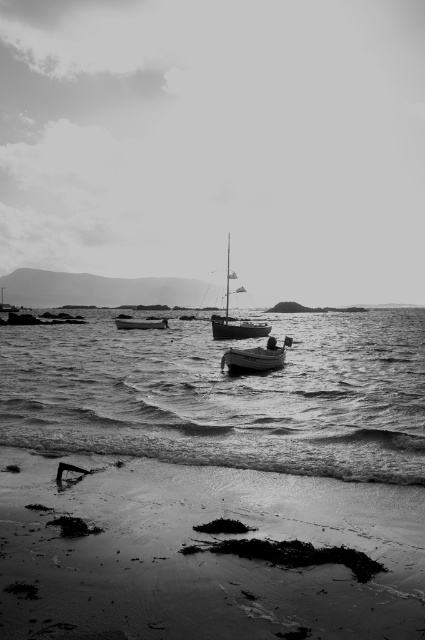
Question: Estimate the real-world distances between objects in this image. Which object is farther from the wooden sailboat at center?

Choices:
 (A) smooth wooden boat at center
 (B) smooth water at center
 (C) smooth sand at lower center
 (D) metallic gray boat at center

Answer: (C)

Question: Is smooth water at center thinner than metallic gray boat at center?

Choices:
 (A) yes
 (B) no

Answer: (B)

Question: Which object is positioned farthest from the smooth sand at lower center?

Choices:
 (A) smooth wooden boat at center
 (B) wooden sailboat at center
 (C) metallic gray boat at center

Answer: (A)

Question: Which point appears closest to the camera in this image?

Choices:
 (A) (218, 330)
 (B) (422, 352)
 (C) (272, 337)
 (D) (155, 317)

Answer: (C)

Question: Can you confirm if smooth sand at lower center is positioned to the left of metallic gray boat at center?

Choices:
 (A) no
 (B) yes

Answer: (B)

Question: Does smooth sand at lower center appear over wooden sailboat at center?

Choices:
 (A) no
 (B) yes

Answer: (A)